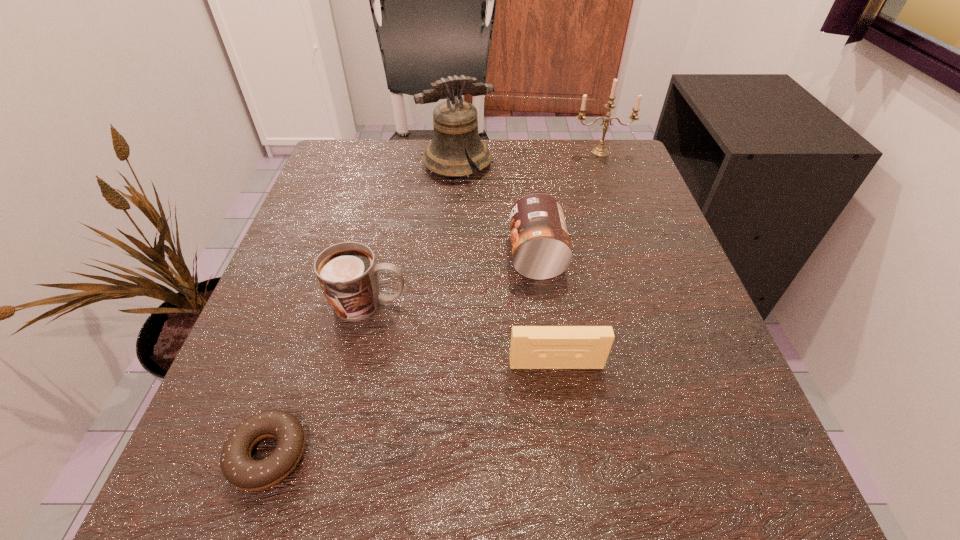
Identify the location of doughnut present at the left edge. This screenshot has height=540, width=960. (243, 472).

The image size is (960, 540). I want to click on object that is at the right edge, so click(x=601, y=151).

At what (x,y) coordinates should I click in order to perform the action: click on object present at the near left corner. Please return your answer as a coordinate pair (x, y). This screenshot has height=540, width=960. Looking at the image, I should click on (243, 472).

This screenshot has width=960, height=540. In order to click on object at the far right corner in this screenshot , I will do `click(601, 151)`.

The width and height of the screenshot is (960, 540). Find the location of `vacant area at the near edge`. vacant area at the near edge is located at coordinates (376, 474).

Where is `free space at the left edge`? The image size is (960, 540). free space at the left edge is located at coordinates (312, 426).

In the image, there is a desktop. What are the coordinates of `blank space at the right edge` in the screenshot? It's located at (587, 233).

Where is `vacant space at the far left corner of the desktop`? The image size is (960, 540). vacant space at the far left corner of the desktop is located at coordinates (373, 143).

I want to click on free space at the near right corner of the desktop, so click(x=726, y=502).

Identify the location of vacant space that is in between the second shortest object and the nearest object. (413, 409).